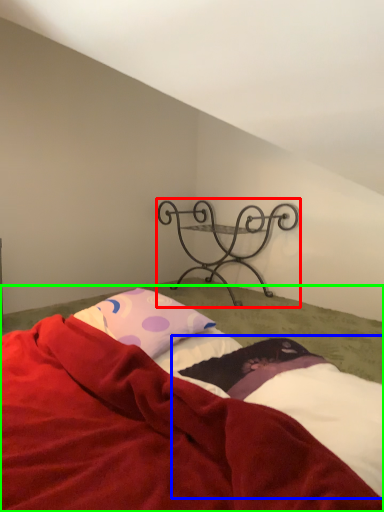
Question: Which object is the farthest from furniture (highlighted by a red box)? Choose among these: sheet (highlighted by a blue box) or bed (highlighted by a green box).

Choices:
 (A) sheet
 (B) bed

Answer: (B)